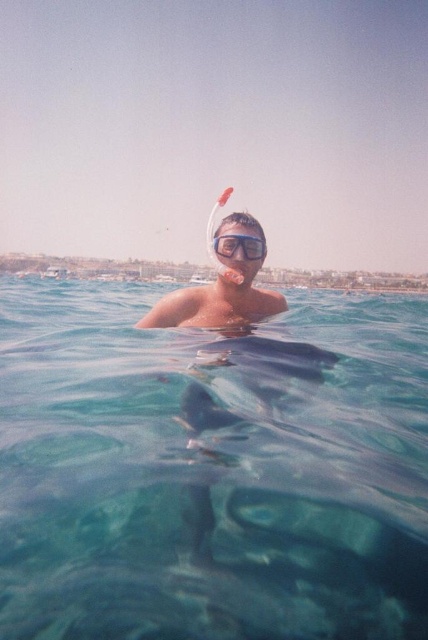
Question: Which object is closer to the camera taking this photo?

Choices:
 (A) transparent plastic goggles at center
 (B) matte plastic snorkel at upper center
 (C) clear blue water at center

Answer: (C)

Question: Does clear blue water at center have a greater width compared to matte plastic snorkel at upper center?

Choices:
 (A) no
 (B) yes

Answer: (B)

Question: Estimate the real-world distances between objects in this image. Which object is farther from the transparent plastic goggles at center?

Choices:
 (A) matte plastic snorkel at upper center
 (B) clear blue water at center

Answer: (B)

Question: Estimate the real-world distances between objects in this image. Which object is farther from the transparent plastic goggles at center?

Choices:
 (A) matte plastic snorkel at upper center
 (B) clear blue water at center

Answer: (B)

Question: Can you confirm if clear blue water at center is positioned to the right of transparent plastic goggles at center?

Choices:
 (A) no
 (B) yes

Answer: (B)

Question: Can you confirm if clear blue water at center is positioned to the left of transparent plastic goggles at center?

Choices:
 (A) yes
 (B) no

Answer: (B)